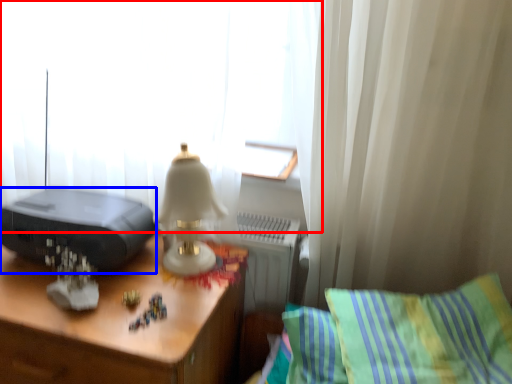
Question: Which of the following is the farthest to the observer, curtain (highlighted by a red box) or printer (highlighted by a blue box)?

Choices:
 (A) curtain
 (B) printer

Answer: (B)